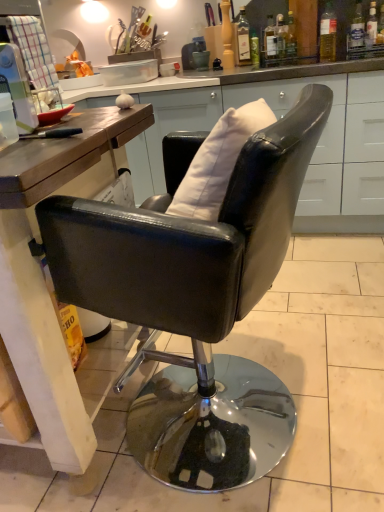
Identify the location of vacant area that is in front of translucent glass bottle at upper right, the 6th bottle in the right-to-left sequence. (279, 65).